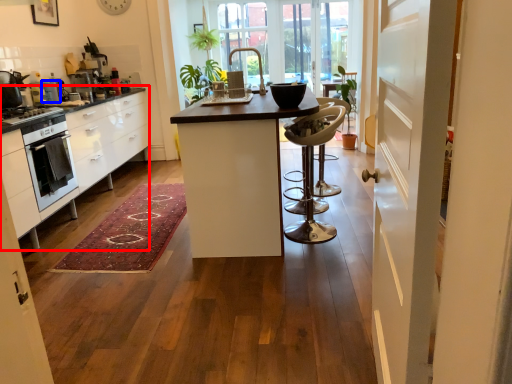
Question: Among these objects, which one is farthest to the camera, cabinetry (highlighted by a red box) or appliance (highlighted by a blue box)?

Choices:
 (A) cabinetry
 (B) appliance

Answer: (B)